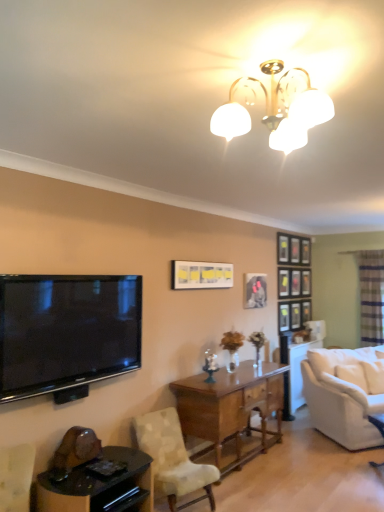
Where is `black glossy table at lower left`? This screenshot has width=384, height=512. black glossy table at lower left is located at coordinates (98, 485).

What do you see at coordinates (67, 333) in the screenshot?
I see `flat-screen tv at left` at bounding box center [67, 333].

This screenshot has width=384, height=512. What do you see at coordinates (173, 459) in the screenshot?
I see `light beige fabric chair at center` at bounding box center [173, 459].

Image resolution: width=384 pixels, height=512 pixels. I want to click on black glossy table at lower left, so click(98, 485).

Visually, is translucent glass door at right positioned to the left or to the right of black glossy table at lower left?

From the image, it's evident that translucent glass door at right is to the right of black glossy table at lower left.

Which is in front, translucent glass door at right or black glossy table at lower left?

black glossy table at lower left is in front.

Are translucent glass door at right and black glossy table at lower left far apart?

Yes, translucent glass door at right and black glossy table at lower left are located far from each other.

From the image's perspective, is light beige fabric chair at center located above or below flat-screen tv at left?

Clearly, from the image's perspective, light beige fabric chair at center is below flat-screen tv at left.

Considering the positions of objects light beige fabric chair at center and flat-screen tv at left in the image provided, who is more to the left, light beige fabric chair at center or flat-screen tv at left?

flat-screen tv at left is more to the left.

Between light beige fabric chair at center and flat-screen tv at left, which one is positioned behind?

light beige fabric chair at center.

Can you confirm if light beige fabric chair at center is bigger than flat-screen tv at left?

Indeed, light beige fabric chair at center has a larger size compared to flat-screen tv at left.

Is translucent glass door at right taller or shorter than light beige fabric chair at center?

Clearly, translucent glass door at right is taller compared to light beige fabric chair at center.

Does point (383, 319) lie in front of point (158, 486)?

No, it is not.

Consider the image. How many degrees apart are the facing directions of translucent glass door at right and light beige fabric chair at center?

78 degrees.

Considering the relative sizes of translucent glass door at right and light beige fabric chair at center in the image provided, is translucent glass door at right bigger than light beige fabric chair at center?

No.

Considering the sizes of translucent glass door at right and matte yellow picture frame at center, marked as the 2th picture frame in a right-to-left arrangement, in the image, is translucent glass door at right bigger or smaller than matte yellow picture frame at center, marked as the 2th picture frame in a right-to-left arrangement,?

In the image, translucent glass door at right appears to be larger than matte yellow picture frame at center, marked as the 2th picture frame in a right-to-left arrangement.

Where is `glass door below the matte yellow picture frame at center, which ranks as the 1th picture frame in left-to-right order (from the image's perspective)`? glass door below the matte yellow picture frame at center, which ranks as the 1th picture frame in left-to-right order (from the image's perspective) is located at coordinates (371, 296).

Which of these two, translucent glass door at right or matte yellow picture frame at center, which ranks as the 1th picture frame in left-to-right order, is thinner?

Thinner between the two is matte yellow picture frame at center, which ranks as the 1th picture frame in left-to-right order.

Can you confirm if translucent glass door at right is positioned to the right of matte yellow picture frame at center, placed as the first picture frame when sorted from front to back?

Correct, you'll find translucent glass door at right to the right of matte yellow picture frame at center, placed as the first picture frame when sorted from front to back.

Which is in front, point (374, 402) or point (383, 251)?

The point (374, 402) is closer to the camera.

Are white fabric couch at right and translucent glass door at right making contact?

white fabric couch at right is not next to translucent glass door at right, and they're not touching.

Which is more to the left, white fabric couch at right or translucent glass door at right?

white fabric couch at right is more to the left.

Considering the positions of objects white fabric couch at right and translucent glass door at right in the image provided, who is behind, white fabric couch at right or translucent glass door at right?

translucent glass door at right is behind.

From the image's perspective, is matte black picture frame at center, which is the first picture frame in back-to-front order, under white fabric couch at right?

Actually, matte black picture frame at center, which is the first picture frame in back-to-front order, appears above white fabric couch at right in the image.

Is white fabric couch at right at the back of matte black picture frame at center, which is counted as the 2th picture frame, starting from the front?

No.

This screenshot has width=384, height=512. In order to click on the 1st picture frame directly above the white fabric couch at right (from a real-world perspective) in this screenshot , I will do `click(255, 290)`.

From the image's perspective, is flat-screen tv at left beneath white fabric couch at right?

Incorrect, from the image's perspective, flat-screen tv at left is higher than white fabric couch at right.

Does flat-screen tv at left have a lesser height compared to white fabric couch at right?

Indeed, flat-screen tv at left has a lesser height compared to white fabric couch at right.

Is flat-screen tv at left next to white fabric couch at right and touching it?

No, flat-screen tv at left is not with white fabric couch at right.

Looking at this image, do you think flat-screen tv at left is within white fabric couch at right, or outside of it?

flat-screen tv at left lies outside white fabric couch at right.

The width and height of the screenshot is (384, 512). I want to click on glass door behind the black glossy table at lower left, so click(x=371, y=296).

Identify the location of chair below the flat-screen tv at left (from a real-world perspective). (173, 459).

Looking at this image, looking at the image, which one is located closer to matte black picture frame at center, which is the first picture frame in back-to-front order, flat-screen tv at left or mahogany wood desk at center?

mahogany wood desk at center lies closer to matte black picture frame at center, which is the first picture frame in back-to-front order, than the other object.

Looking at the image, which one is located closer to mahogany wood desk at center, white fabric couch at right or translucent glass door at right?

white fabric couch at right is closer to mahogany wood desk at center.

Which object lies nearer to the anchor point matte black picture frame at center, which is counted as the 2th picture frame, starting from the front, translucent glass door at right or light beige fabric chair at center?

light beige fabric chair at center is positioned closer to the anchor matte black picture frame at center, which is counted as the 2th picture frame, starting from the front.

Based on their spatial positions, is light beige fabric chair at center or mahogany wood desk at center further from translucent glass door at right?

light beige fabric chair at center.

When comparing their distances from white fabric couch at right, does flat-screen tv at left or translucent glass door at right seem closer?

Based on the image, translucent glass door at right appears to be nearer to white fabric couch at right.

Estimate the real-world distances between objects in this image. Which object is further from flat-screen tv at left, translucent glass door at right or mahogany wood desk at center?

translucent glass door at right.

Estimate the real-world distances between objects in this image. Which object is closer to light beige fabric chair at center, black glossy table at lower left or matte black picture frame at center, which is counted as the 2th picture frame, starting from the left?

The object closer to light beige fabric chair at center is black glossy table at lower left.

Which object lies further to the anchor point white fabric couch at right, mahogany wood desk at center or matte yellow picture frame at center, which appears as the second picture frame when viewed from the back?

matte yellow picture frame at center, which appears as the second picture frame when viewed from the back, lies further to white fabric couch at right than the other object.

Locate an element on the screen. This screenshot has width=384, height=512. television located between black glossy table at lower left and translucent glass door at right in the depth direction is located at coordinates (67, 333).

Find the location of `desk between matte yellow picture frame at center, marked as the 2th picture frame in a right-to-left arrangement, and light beige fabric chair at center from top to bottom`. desk between matte yellow picture frame at center, marked as the 2th picture frame in a right-to-left arrangement, and light beige fabric chair at center from top to bottom is located at coordinates (231, 408).

At what (x,y) coordinates should I click in order to perform the action: click on desk between matte yellow picture frame at center, placed as the first picture frame when sorted from front to back, and translucent glass door at right. Please return your answer as a coordinate pair (x, y). This screenshot has height=512, width=384. Looking at the image, I should click on (231, 408).

Where is `chair that lies between flat-screen tv at left and black glossy table at lower left from top to bottom`? This screenshot has height=512, width=384. chair that lies between flat-screen tv at left and black glossy table at lower left from top to bottom is located at coordinates (173, 459).